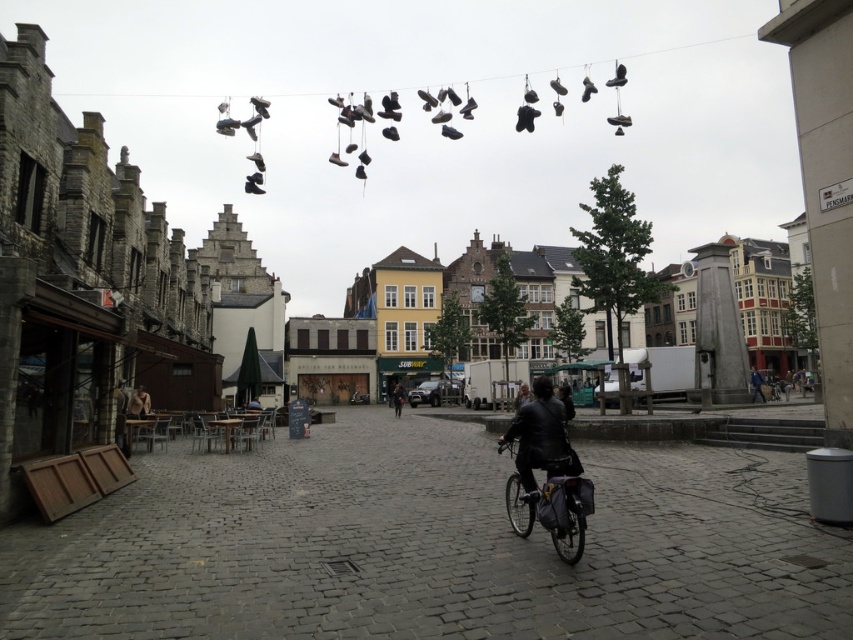
You are a pedestrian standing at the edge of the square and want to cross to the other side. There is a shiny metallic bicycle at center and a leather jacket at center in your path. Which object should you move around to avoid collision?

You should move around the leather jacket at center since the shiny metallic bicycle at center is positioned to its left side, meaning the jacket is further to the right. By moving around the jacket, you can navigate safely past both objects.

You are a delivery person who needs to carry a large package that requires a space wider than the shiny metallic bicycle at center. Can the blue denim jacket at center provide enough space for the package?

The shiny metallic bicycle at center has a lesser width compared to blue denim jacket at center. Therefore, the blue denim jacket at center is wider and can accommodate the large package.

You are standing at the center of the square and want to locate the shiny metallic bicycle. According to the image, where is the point at coordinate (553, 512) located?

The point at coordinate (553, 512) is located on the shiny metallic bicycle at center.